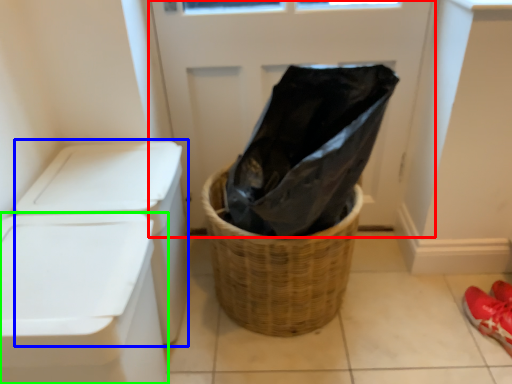
Question: Based on their relative distances, which object is farther from screen door (highlighted by a red box)? Choose from washer (highlighted by a blue box) and waste container (highlighted by a green box).

Choices:
 (A) washer
 (B) waste container

Answer: (B)